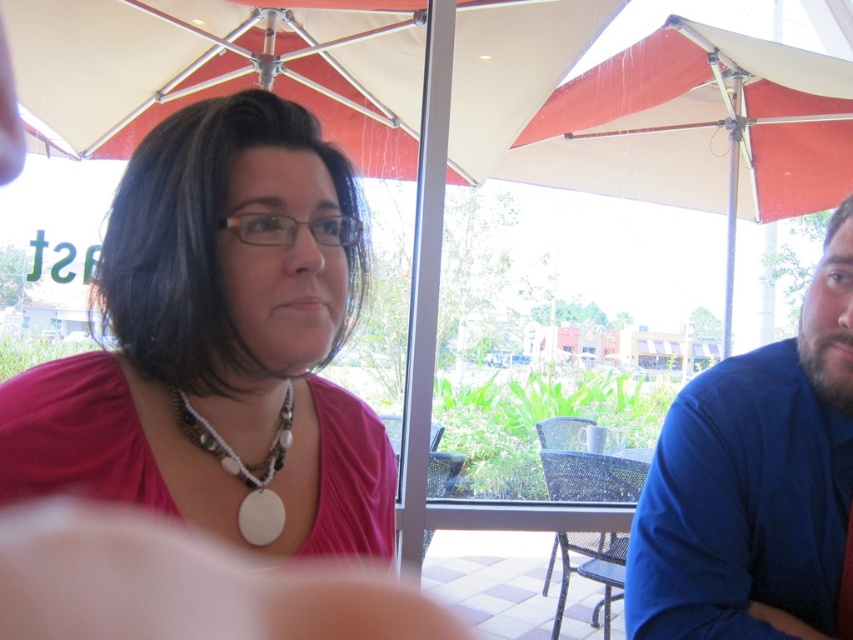
Between point (347, 540) and point (405, 97), which one is positioned behind?

Point (405, 97)

Who is positioned more to the right, pink fabric shirt at center or white fabric umbrella at upper center?

Positioned to the right is pink fabric shirt at center.

Find the location of a particular element. Image resolution: width=853 pixels, height=640 pixels. pink fabric shirt at center is located at coordinates (218, 339).

Which is behind, point (393, 115) or point (250, 472)?

Point (393, 115)

Between point (71, 90) and point (282, 464), which one is positioned behind?

The point (71, 90) is more distant.

This screenshot has width=853, height=640. In order to click on white fabric umbrella at upper center in this screenshot , I will do `click(219, 68)`.

Identify the location of blue fabric shirt at right. The height and width of the screenshot is (640, 853). (755, 483).

Which is behind, point (700, 451) or point (267, 468)?

Positioned behind is point (700, 451).

Where is `blue fabric shirt at right`? The image size is (853, 640). blue fabric shirt at right is located at coordinates [755, 483].